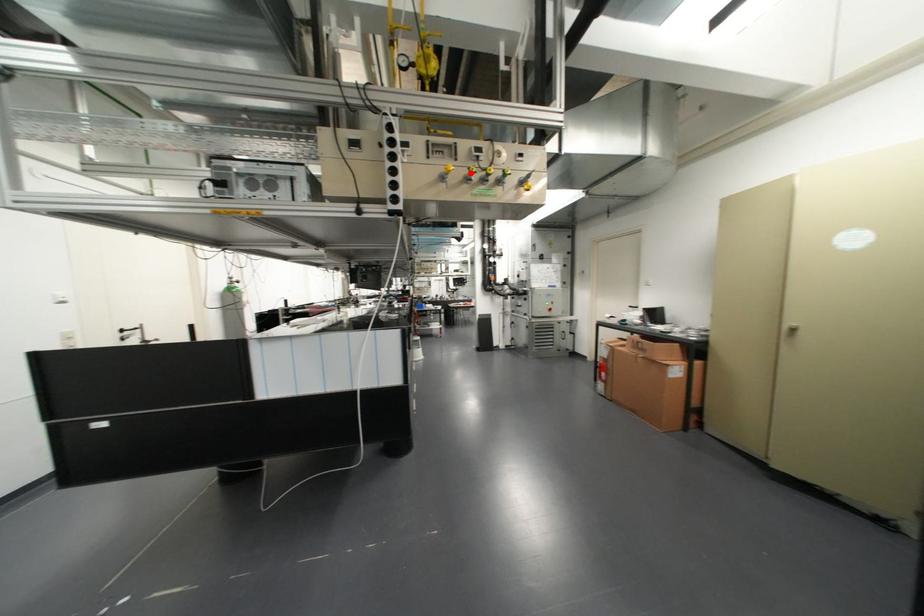
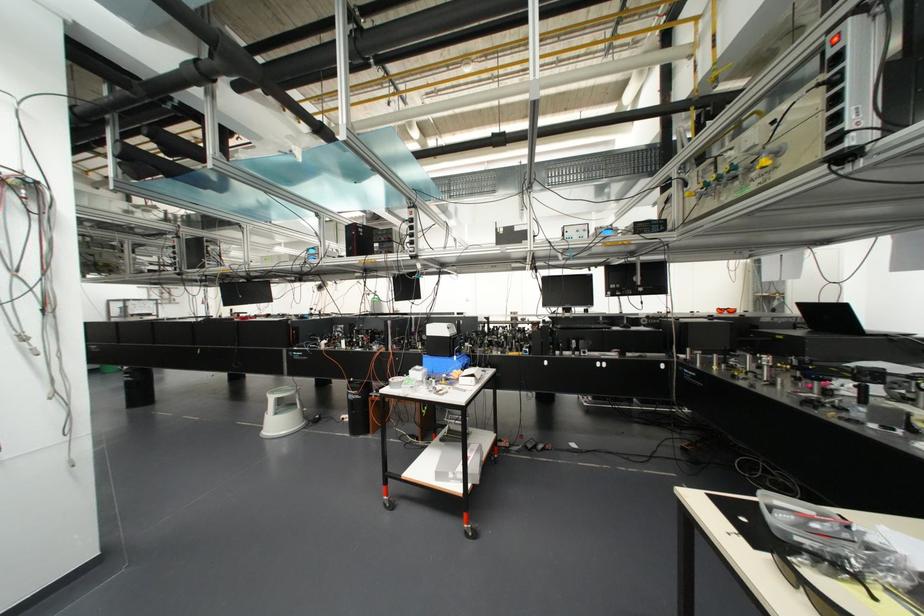
Question: I am providing you with two images of the same scene from different viewpoints. A red point is marked on the first image. At the location where the point appears in image 1, is it still visible in image 2?

Choices:
 (A) Yes
 (B) No

Answer: (B)